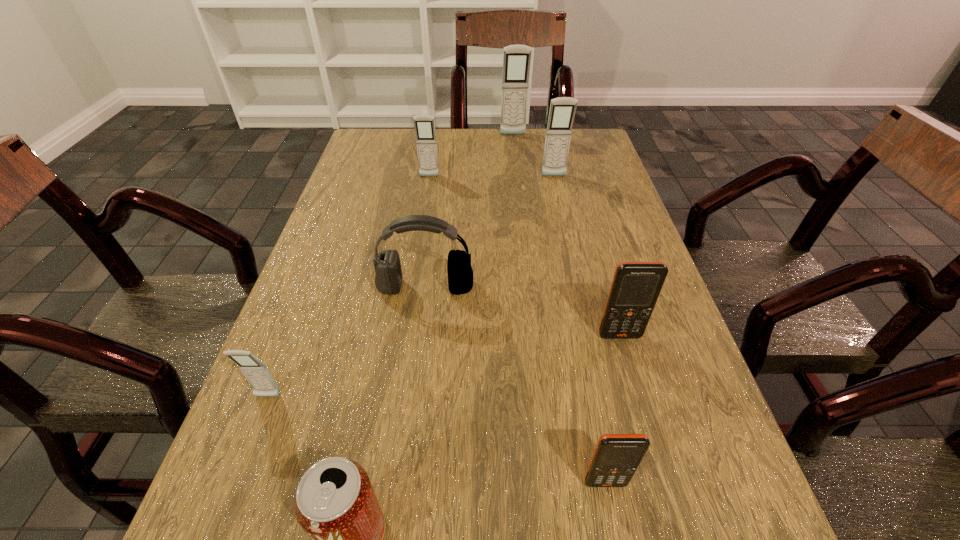
This screenshot has width=960, height=540. I want to click on the left orange cellular telephone, so (616, 458).

Identify the location of the nearest cellular telephone. (616, 458).

Locate an element on the screen. The image size is (960, 540). the leftmost gray cellular telephone is located at coordinates (257, 374).

This screenshot has width=960, height=540. In order to click on the nearest gray cellular telephone in this screenshot , I will do `click(257, 374)`.

Image resolution: width=960 pixels, height=540 pixels. Find the location of `vacant space situated 0.050m on the front-facing side of the third cellular telephone from left to right`. vacant space situated 0.050m on the front-facing side of the third cellular telephone from left to right is located at coordinates (514, 145).

In order to click on free space located on the front-facing side of the rightmost gray cellular telephone in this screenshot , I will do coord(567,234).

Locate an element on the screen. Image resolution: width=960 pixels, height=540 pixels. free space located on the front-facing side of the third gray cellular telephone from right to left is located at coordinates (422, 221).

Identify the location of vacant space located on the screen of the fifth farthest object. Image resolution: width=960 pixels, height=540 pixels. (654, 452).

The width and height of the screenshot is (960, 540). Find the location of `vacant point located on the headband of the fifth nearest object`. vacant point located on the headband of the fifth nearest object is located at coordinates (402, 481).

The height and width of the screenshot is (540, 960). I want to click on free space located on the front-facing side of the sixth farthest object, so click(x=236, y=477).